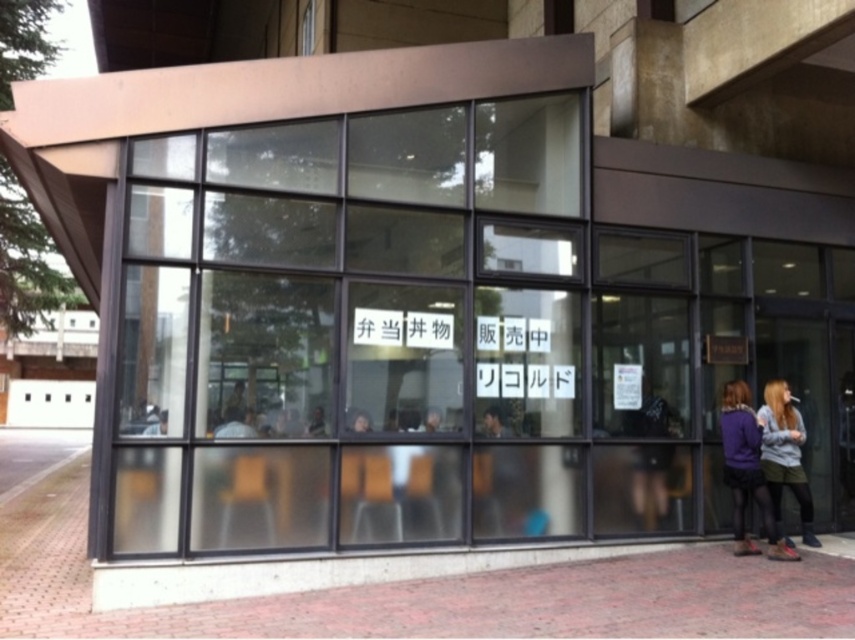
You are a delivery person who needs to park your bike. The bike requires a space larger than the matte purple hoodie at lower right. Is there a suitable parking spot available on the brick pavement at lower center?

The brick pavement at lower center has a larger size compared to the matte purple hoodie at lower right, so yes, the bike can be parked there as the brick pavement at lower center provides sufficient space.

You are a delivery person with a cart that is 1.5 meters wide. You need to deliver a package to the entrance of the building. Can you fit your cart between the brick pavement at lower center and the matte purple hoodie at lower right?

The distance between the brick pavement at lower center and the matte purple hoodie at lower right is 1.51 meters, so the cart which is 1.5 meters wide can fit through the space.